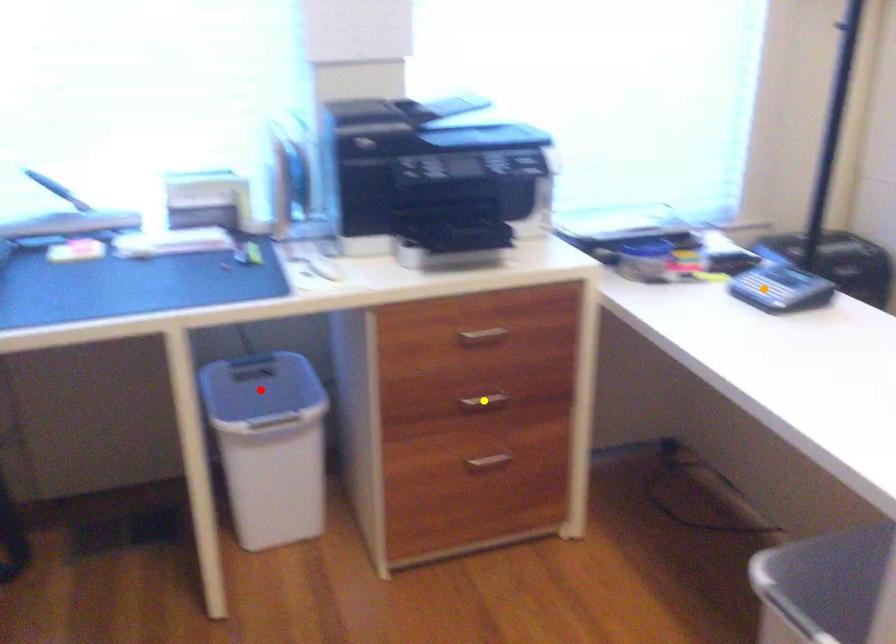
Order these from nearest to farthest:
A) yellow point
B) orange point
C) red point

A: orange point < yellow point < red point